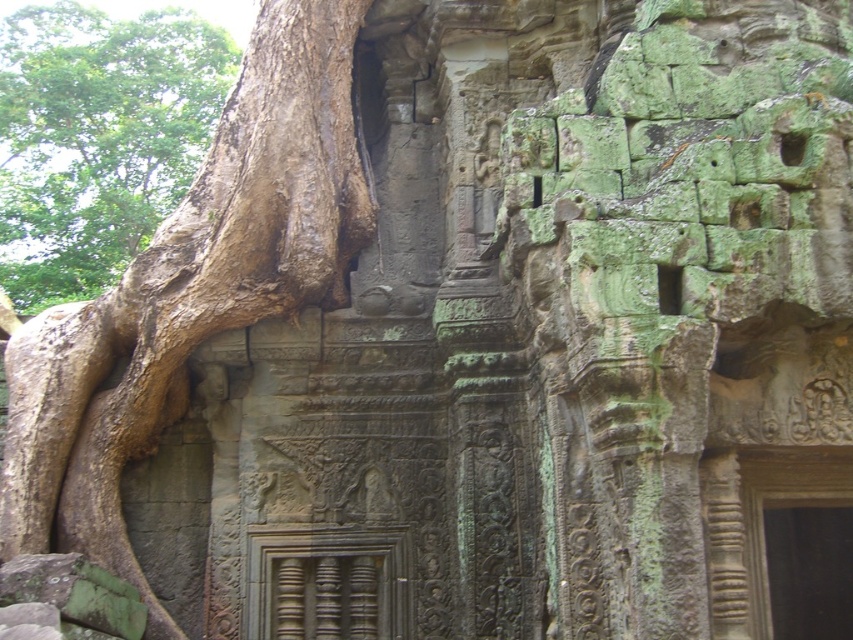
Does brown rough tree trunk at left lie behind brown rough bark at left?

That is False.

Between brown rough tree trunk at left and brown rough bark at left, which one appears on the right side from the viewer's perspective?

brown rough tree trunk at left

Does point (340, 116) lie in front of point (144, 212)?

That is True.

In order to click on brown rough tree trunk at left in this screenshot , I will do point(190,289).